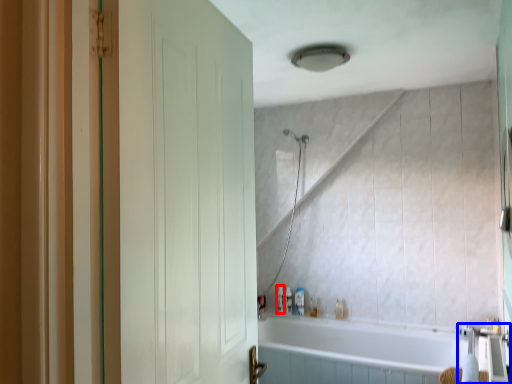
Question: Which object is further to the camera taking this photo, toiletry (highlighted by a red box) or faucet (highlighted by a blue box)?

Choices:
 (A) toiletry
 (B) faucet

Answer: (A)